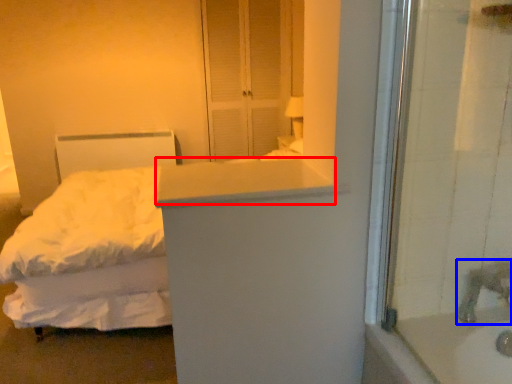
Question: Which object appears closest to the camera in this image, counter top (highlighted by a red box) or faucet (highlighted by a blue box)?

Choices:
 (A) counter top
 (B) faucet

Answer: (A)